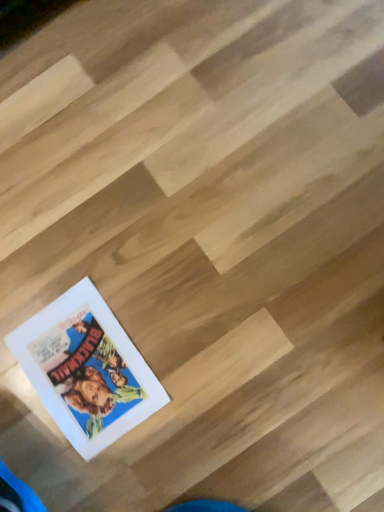
The height and width of the screenshot is (512, 384). I want to click on empty space that is ontop of matte paper book at bottom left (from a real-world perspective), so click(79, 371).